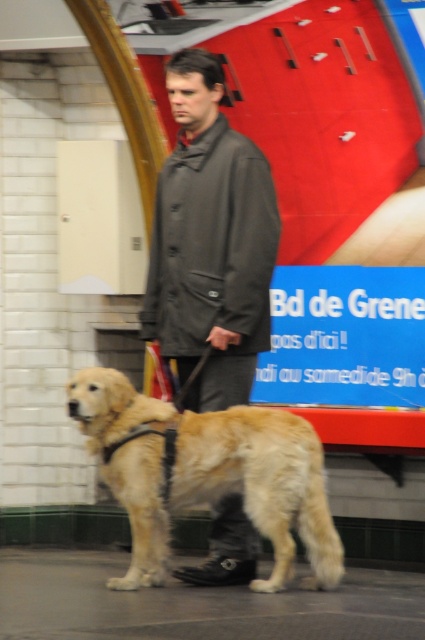
Who is positioned more to the right, dark gray coat at center or blue plastic sign at center?

blue plastic sign at center

Which is below, dark gray coat at center or blue plastic sign at center?

blue plastic sign at center is below.

The image size is (425, 640). Find the location of `dark gray coat at center`. dark gray coat at center is located at coordinates (209, 243).

Where is `dark gray coat at center`? dark gray coat at center is located at coordinates (209, 243).

Which is more to the right, dark gray coat at center or golden fur dog at center?

dark gray coat at center is more to the right.

Does point (269, 278) lie behind point (113, 428)?

Yes.

Where is `dark gray coat at center`? dark gray coat at center is located at coordinates (209, 243).

Who is more distant from viewer, (289, 426) or (297, 365)?

Positioned behind is point (297, 365).

Between golden fur dog at center and blue plastic sign at center, which one has less height?

With less height is blue plastic sign at center.

Find the location of a particular element. Image resolution: width=425 pixels, height=640 pixels. golden fur dog at center is located at coordinates (206, 474).